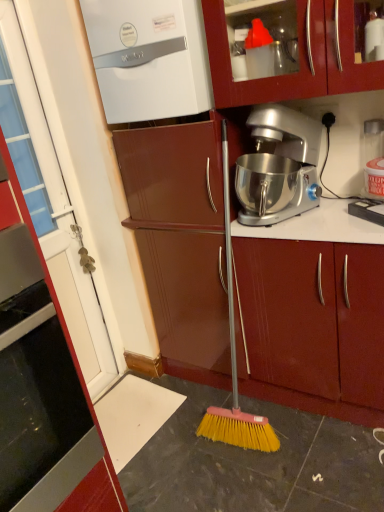
Question: Is silver metallic stand mixer at center facing towards matte wood cabinet at center, placed as the 1th cabinetry when sorted from back to front?

Choices:
 (A) yes
 (B) no

Answer: (B)

Question: Can you confirm if silver metallic stand mixer at center is taller than matte wood cabinet at center, which ranks as the 2th cabinetry in left-to-right order?

Choices:
 (A) yes
 (B) no

Answer: (B)

Question: Considering the relative positions of silver metallic stand mixer at center and matte wood cabinet at center, the second cabinetry from the front, in the image provided, is silver metallic stand mixer at center in front of matte wood cabinet at center, the second cabinetry from the front,?

Choices:
 (A) no
 (B) yes

Answer: (B)

Question: Would you say silver metallic stand mixer at center is outside matte wood cabinet at center, placed as the 1th cabinetry when sorted from back to front?

Choices:
 (A) yes
 (B) no

Answer: (A)

Question: Considering the relative positions of silver metallic stand mixer at center and matte wood cabinet at center, placed as the 1th cabinetry when sorted from back to front, in the image provided, is silver metallic stand mixer at center to the right of matte wood cabinet at center, placed as the 1th cabinetry when sorted from back to front, from the viewer's perspective?

Choices:
 (A) yes
 (B) no

Answer: (B)

Question: From the image's perspective, would you say silver metallic stand mixer at center is positioned over matte wood cabinet at center, placed as the 1th cabinetry when sorted from back to front?

Choices:
 (A) yes
 (B) no

Answer: (A)

Question: Is the position of silver metallic stand mixer at center less distant than that of white glossy boiler at upper left?

Choices:
 (A) no
 (B) yes

Answer: (B)

Question: Is silver metallic stand mixer at center wider than white glossy boiler at upper left?

Choices:
 (A) no
 (B) yes

Answer: (B)

Question: Is silver metallic stand mixer at center positioned far away from white glossy boiler at upper left?

Choices:
 (A) no
 (B) yes

Answer: (A)

Question: From the image's perspective, is silver metallic stand mixer at center over white glossy boiler at upper left?

Choices:
 (A) no
 (B) yes

Answer: (A)

Question: Is white glossy boiler at upper left surrounded by silver metallic stand mixer at center?

Choices:
 (A) yes
 (B) no

Answer: (B)

Question: Can you confirm if silver metallic stand mixer at center is positioned to the left of white glossy boiler at upper left?

Choices:
 (A) no
 (B) yes

Answer: (A)

Question: Considering the relative sizes of matte wood cabinet at center, which ranks as the 2th cabinetry in left-to-right order, and white glossy door at left, placed as the second cabinetry when sorted from back to front, in the image provided, is matte wood cabinet at center, which ranks as the 2th cabinetry in left-to-right order, shorter than white glossy door at left, placed as the second cabinetry when sorted from back to front,?

Choices:
 (A) yes
 (B) no

Answer: (B)